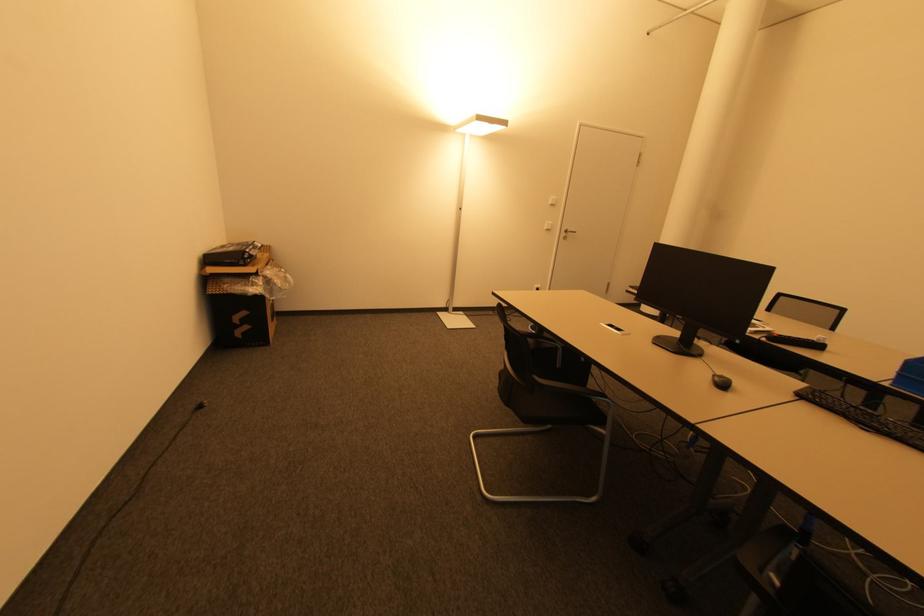
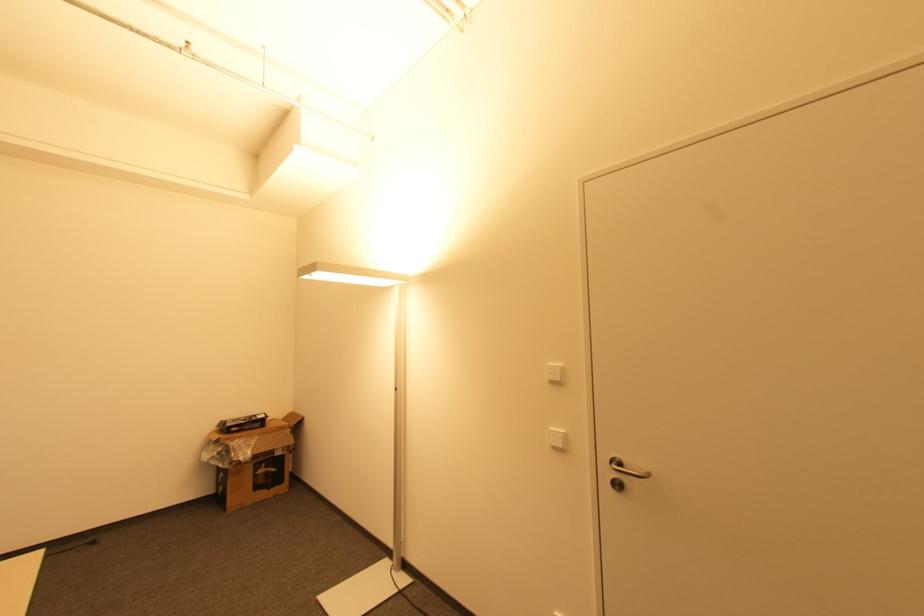
Where in the second image is the point corresponding to point (550, 230) from the first image?

(557, 448)